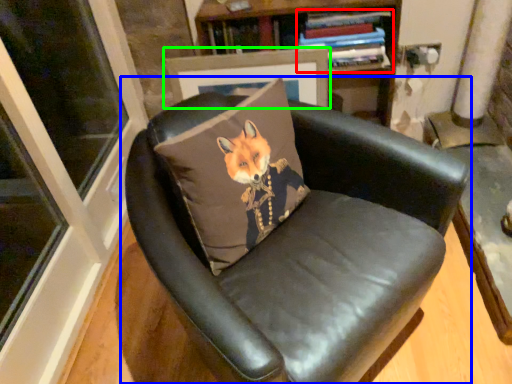
Question: Considering the real-world distances, which object is closest to book (highlighted by a red box)? chair (highlighted by a blue box) or picture frame (highlighted by a green box).

Choices:
 (A) chair
 (B) picture frame

Answer: (B)